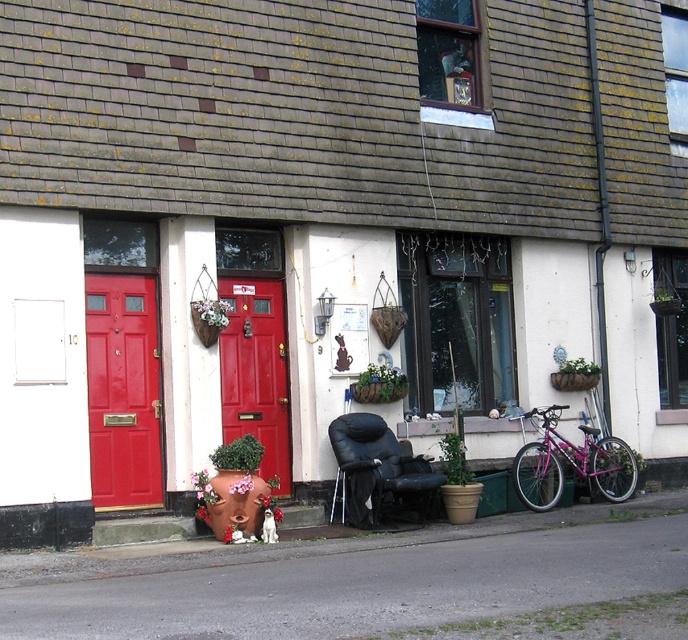
Between matte red door at left and shiny red door at center, which one appears on the right side from the viewer's perspective?

From the viewer's perspective, shiny red door at center appears more on the right side.

At what (x,y) coordinates should I click in order to perform the action: click on matte red door at left. Please return your answer as a coordinate pair (x, y). The height and width of the screenshot is (640, 688). Looking at the image, I should click on (122, 390).

Does point (107, 394) lie behind point (255, 320)?

No.

Where is `matte red door at left`? matte red door at left is located at coordinates (122, 390).

Between point (233, 390) and point (616, 480), which one is positioned behind?

The point (616, 480) is more distant.

Does point (228, 308) lie behind point (592, 461)?

No, it is not.

Which is behind, point (252, 419) or point (610, 444)?

Point (610, 444)

Locate an element on the screen. This screenshot has width=688, height=640. shiny red door at center is located at coordinates (255, 371).

Is matte red door at left bigger than pink metallic bicycle at lower right?

No, matte red door at left is not bigger than pink metallic bicycle at lower right.

Does matte red door at left come behind pink metallic bicycle at lower right?

No, matte red door at left is in front of pink metallic bicycle at lower right.

Measure the distance between point (x=142, y=440) and camera.

Point (x=142, y=440) is 11.49 meters away from camera.

Find the location of `matte red door at left`. matte red door at left is located at coordinates (122, 390).